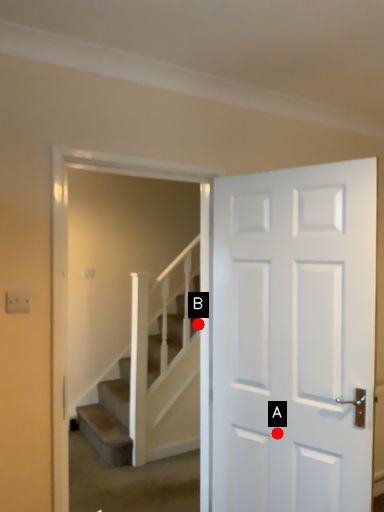
Question: Two points are circled on the image, labeled by A and B beside each circle. Which point is closer to the camera taking this photo?

Choices:
 (A) A is closer
 (B) B is closer

Answer: (A)